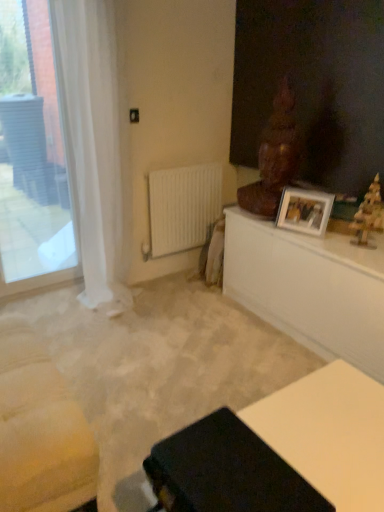
This screenshot has height=512, width=384. I want to click on vacant space situated on the left part of wooden christmas tree at right, marked as the first sculpture in a front-to-back arrangement, so click(336, 244).